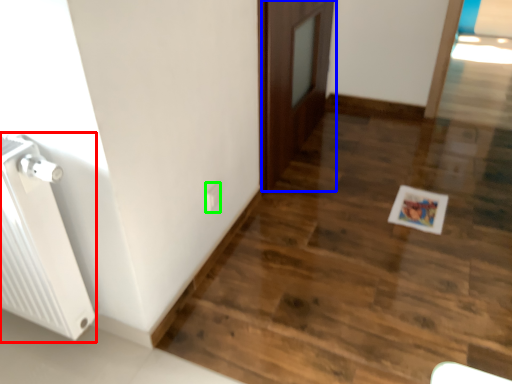
Question: Which is farther away from radiator (highlighted by a red box)? door (highlighted by a blue box) or electric outlet (highlighted by a green box)?

Choices:
 (A) door
 (B) electric outlet

Answer: (A)